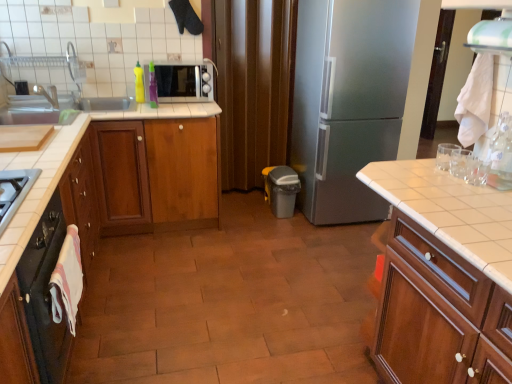
What do you see at coordinates (152, 86) in the screenshot?
I see `green plastic bottle at upper left, positioned as the second bottle in left-to-right order` at bounding box center [152, 86].

The height and width of the screenshot is (384, 512). Describe the element at coordinates (438, 314) in the screenshot. I see `wooden cabinet at right, which ranks as the 1th cabinetry in right-to-left order` at that location.

This screenshot has width=512, height=384. What do you see at coordinates (183, 83) in the screenshot?
I see `white glossy microwave at upper center` at bounding box center [183, 83].

In order to face wooden cabinet at left, the 1th cabinetry when ordered from left to right, should I rotate leftwards or rightwards?

It's best to rotate left around 30.202 degrees.

You are a GUI agent. You are given a task and a screenshot of the screen. Output one action in this format:
    pyautogui.click(x=<x>, y=<y>)
    Task: Click on the white tile countertop at right
    The height and width of the screenshot is (384, 512).
    Given the screenshot: What is the action you would take?
    pyautogui.click(x=450, y=211)

Find the location of a particular element. This screenshot has width=512, height=384. satin silver gas stove at lower left is located at coordinates (14, 192).

Where is `wooden cabinet at center, acting as the 2th cabinetry starting from the right`? wooden cabinet at center, acting as the 2th cabinetry starting from the right is located at coordinates (156, 174).

What do you see at coordinates (139, 83) in the screenshot?
I see `yellow matte bottle at upper left, positioned as the 3th bottle in right-to-left order` at bounding box center [139, 83].

At what (x,y) coordinates should I click in order to perform the action: click on green plastic bottle at upper left, the 2th bottle when ordered from front to back. Please return your answer as a coordinate pair (x, y). This screenshot has width=512, height=384. Looking at the image, I should click on (152, 86).

From the image's perspective, between clear plastic bottle at right, the first bottle when ordered from bottom to top, and wooden cabinet at left, placed as the fourth cabinetry when sorted from right to left, who is located below?

wooden cabinet at left, placed as the fourth cabinetry when sorted from right to left.

Is clear plastic bottle at right, which ranks as the 1th bottle in front-to-back order, inside or outside of wooden cabinet at left, placed as the fourth cabinetry when sorted from right to left?

clear plastic bottle at right, which ranks as the 1th bottle in front-to-back order, is located beyond the bounds of wooden cabinet at left, placed as the fourth cabinetry when sorted from right to left.

Between clear plastic bottle at right, which appears as the third bottle when viewed from the back, and wooden cabinet at left, the 1th cabinetry when ordered from left to right, which one is positioned in front?

wooden cabinet at left, the 1th cabinetry when ordered from left to right, is more forward.

In order to click on the 3rd bottle counting from the right of the wooden cabinet at left, placed as the fourth cabinetry when sorted from right to left in this screenshot , I will do `click(501, 154)`.

Does wooden cabinet at left, placed as the fourth cabinetry when sorted from right to left, lie behind satin silver gas stove at lower left?

No, it is in front of satin silver gas stove at lower left.

Could you tell me if wooden cabinet at left, placed as the fourth cabinetry when sorted from right to left, is facing satin silver gas stove at lower left?

No, wooden cabinet at left, placed as the fourth cabinetry when sorted from right to left, is not oriented towards satin silver gas stove at lower left.

Is wooden cabinet at left, placed as the fourth cabinetry when sorted from right to left, wider or thinner than satin silver gas stove at lower left?

wooden cabinet at left, placed as the fourth cabinetry when sorted from right to left, is wider than satin silver gas stove at lower left.

Considering the sizes of wooden cabinet at left, the 1th cabinetry when ordered from left to right, and satin silver gas stove at lower left in the image, is wooden cabinet at left, the 1th cabinetry when ordered from left to right, bigger or smaller than satin silver gas stove at lower left?

wooden cabinet at left, the 1th cabinetry when ordered from left to right, is bigger than satin silver gas stove at lower left.

Could you tell me if satin silver refrigerator at center is facing wooden cabinet at center, the 2th cabinetry when ordered from left to right?

No, satin silver refrigerator at center is not aimed at wooden cabinet at center, the 2th cabinetry when ordered from left to right.

Locate an element on the screen. This screenshot has width=512, height=384. refrigerator behind the wooden cabinet at center, the third cabinetry in the right-to-left sequence is located at coordinates (348, 101).

Based on the photo, would you consider satin silver refrigerator at center to be distant from wooden cabinet at center, the third cabinetry in the right-to-left sequence?

Yes, satin silver refrigerator at center and wooden cabinet at center, the third cabinetry in the right-to-left sequence, are located far from each other.

Measure the distance between satin silver refrigerator at center and wooden cabinet at center, the third cabinetry in the right-to-left sequence.

They are 1.09 meters apart.

What's the angular difference between brown matte curtain at center and white glossy microwave at upper center's facing directions?

The facing directions of brown matte curtain at center and white glossy microwave at upper center are 0.00233 degrees apart.

From a real-world perspective, is brown matte curtain at center on top of white glossy microwave at upper center?

Actually, brown matte curtain at center is physically below white glossy microwave at upper center in the real world.

Is white glossy microwave at upper center at the back of brown matte curtain at center?

No, brown matte curtain at center is not facing the opposite direction of white glossy microwave at upper center.

Considering their positions, is brown matte curtain at center located in front of or behind white glossy microwave at upper center?

Clearly, brown matte curtain at center is behind white glossy microwave at upper center.

How different are the orientations of brown matte curtain at center and wooden cabinet at right, which ranks as the 1th cabinetry in right-to-left order, in degrees?

The angle between the facing direction of brown matte curtain at center and the facing direction of wooden cabinet at right, which ranks as the 1th cabinetry in right-to-left order, is 88.9 degrees.

Is brown matte curtain at center shorter than wooden cabinet at right, which ranks as the 1th cabinetry in right-to-left order?

In fact, brown matte curtain at center may be taller than wooden cabinet at right, which ranks as the 1th cabinetry in right-to-left order.

Are brown matte curtain at center and wooden cabinet at right, which ranks as the 1th cabinetry in right-to-left order, beside each other?

No, brown matte curtain at center is not next to wooden cabinet at right, which ranks as the 1th cabinetry in right-to-left order.

Consider the image. From a real-world perspective, is brown matte curtain at center located beneath wooden cabinet at right, which ranks as the 1th cabinetry in right-to-left order?

Incorrect, from a real-world perspective, brown matte curtain at center is higher than wooden cabinet at right, which ranks as the 1th cabinetry in right-to-left order.

Is white glossy exhaust hood at upper right inside or outside of green plastic bottle at upper left, which is the 2th bottle in back-to-front order?

white glossy exhaust hood at upper right is outside green plastic bottle at upper left, which is the 2th bottle in back-to-front order.

Can you confirm if white glossy exhaust hood at upper right is shorter than green plastic bottle at upper left, the 2th bottle when ordered from front to back?

Yes.

Is white glossy exhaust hood at upper right oriented away from green plastic bottle at upper left, positioned as the second bottle in left-to-right order?

That's not correct — white glossy exhaust hood at upper right is not looking away from green plastic bottle at upper left, positioned as the second bottle in left-to-right order.

Can you tell me how much white glossy exhaust hood at upper right and green plastic bottle at upper left, which ranks as the second bottle in bottom-to-top order, differ in facing direction?

They differ by 88.9 degrees in their facing directions.

Is white tile countertop at right touching wooden cabinet at center, the third cabinetry in the right-to-left sequence?

white tile countertop at right is not next to wooden cabinet at center, the third cabinetry in the right-to-left sequence, and they're not touching.

From the image's perspective, is white tile countertop at right located above or below wooden cabinet at center, the 2th cabinetry when ordered from left to right?

Based on their image positions, white tile countertop at right is located above wooden cabinet at center, the 2th cabinetry when ordered from left to right.

Based on the photo, how many degrees apart are the facing directions of white tile countertop at right and wooden cabinet at center, the 2th cabinetry when ordered from left to right?

They differ by 180 degrees in their facing directions.

Can wooden cabinet at center, the third cabinetry in the right-to-left sequence, be found inside white tile countertop at right?

No, wooden cabinet at center, the third cabinetry in the right-to-left sequence, is located outside of white tile countertop at right.

The image size is (512, 384). There is a clear plastic bottle at right, placed as the third bottle when sorted from left to right. What are the coordinates of `the 2nd cabinetry below it (from the image's perspective)` in the screenshot? It's located at (35, 307).

Find the location of `gas stove that appears above the wooden cabinet at left, placed as the fourth cabinetry when sorted from right to left (from the image's perspective)`. gas stove that appears above the wooden cabinet at left, placed as the fourth cabinetry when sorted from right to left (from the image's perspective) is located at coordinates (14, 192).

Looking at the image, which one is located further to white glossy exhaust hood at upper right, satin silver refrigerator at center or wooden cabinet at center, the third cabinetry in the right-to-left sequence?

wooden cabinet at center, the third cabinetry in the right-to-left sequence, is further to white glossy exhaust hood at upper right.

Which object lies further to the anchor point wooden cabinet at right, which ranks as the 1th cabinetry in right-to-left order, clear plastic bottle at right, placed as the first bottle when sorted from right to left, or white tile countertop at right?

Based on the image, clear plastic bottle at right, placed as the first bottle when sorted from right to left, appears to be further to wooden cabinet at right, which ranks as the 1th cabinetry in right-to-left order.

Considering their positions, is green plastic bottle at upper left, which is the 2th bottle from right to left, positioned closer to white glossy microwave at upper center than white glossy exhaust hood at upper right?

Based on the image, green plastic bottle at upper left, which is the 2th bottle from right to left, appears to be nearer to white glossy microwave at upper center.

Which object lies nearer to the anchor point satin silver gas stove at lower left, yellow matte bottle at upper left, which ranks as the 1th bottle in top-to-bottom order, or wooden cabinet at center, the third cabinetry viewed from the left?

wooden cabinet at center, the third cabinetry viewed from the left, is closer to satin silver gas stove at lower left.

Considering their positions, is white tile countertop at right positioned further to green plastic bottle at upper left, the 2th bottle when ordered from front to back, than white glossy microwave at upper center?

white tile countertop at right is further to green plastic bottle at upper left, the 2th bottle when ordered from front to back.

From the image, which object appears to be nearer to wooden cabinet at center, acting as the 2th cabinetry starting from the right, satin silver refrigerator at center or green plastic bottle at upper left, which is the 2th bottle from right to left?

Based on the image, green plastic bottle at upper left, which is the 2th bottle from right to left, appears to be nearer to wooden cabinet at center, acting as the 2th cabinetry starting from the right.

Based on their spatial positions, is wooden cabinet at right, which ranks as the 1th cabinetry in right-to-left order, or white tile countertop at right closer to green plastic bottle at upper left, the 2th bottle when ordered from front to back?

white tile countertop at right.

From the image, which object appears to be nearer to white glossy microwave at upper center, wooden cabinet at left, the 1th cabinetry when ordered from left to right, or satin silver refrigerator at center?

satin silver refrigerator at center.

Locate an element on the screen. appliance between clear plastic bottle at right, which ranks as the 1th bottle in front-to-back order, and brown matte curtain at center, along the z-axis is located at coordinates (183, 83).

Find the location of a particular element. gas stove between wooden cabinet at left, the 1th cabinetry when ordered from left to right, and yellow matte bottle at upper left, which ranks as the 1th bottle in top-to-bottom order, in the front-back direction is located at coordinates (14, 192).

Identify the location of appliance located between satin silver gas stove at lower left and yellow matte bottle at upper left, positioned as the 3th bottle in right-to-left order, in the depth direction. (183, 83).

The width and height of the screenshot is (512, 384). Find the location of `gas stove located between white tile countertop at right and green plastic bottle at upper left, which ranks as the second bottle in bottom-to-top order, in the depth direction`. gas stove located between white tile countertop at right and green plastic bottle at upper left, which ranks as the second bottle in bottom-to-top order, in the depth direction is located at coordinates (14, 192).